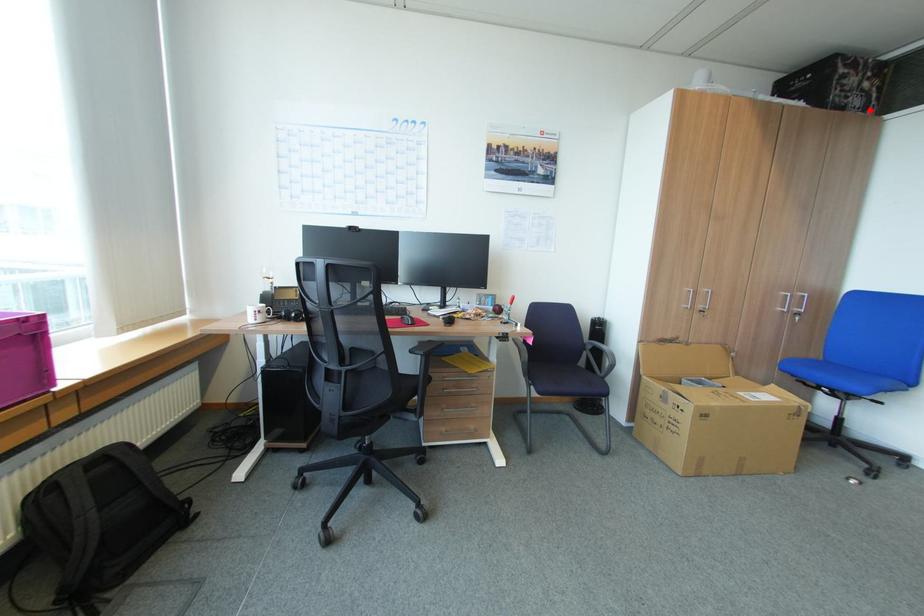
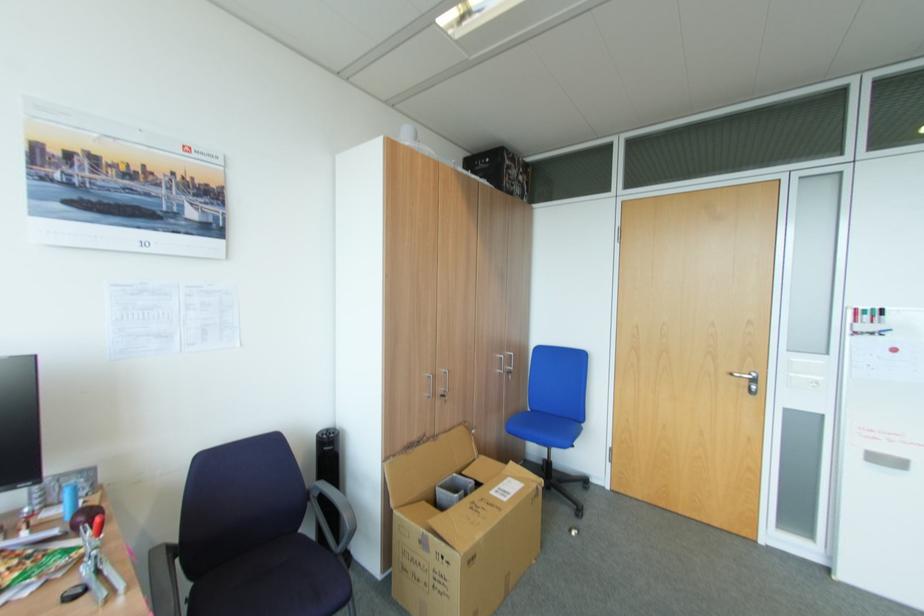
Question: A red point is marked in image1. In image2, is the corresponding 3D point closer to the camera or farther? Reply with the corresponding letter.

Choices:
 (A) The corresponding 3D point is closer.
 (B) The corresponding 3D point is farther.

Answer: (A)